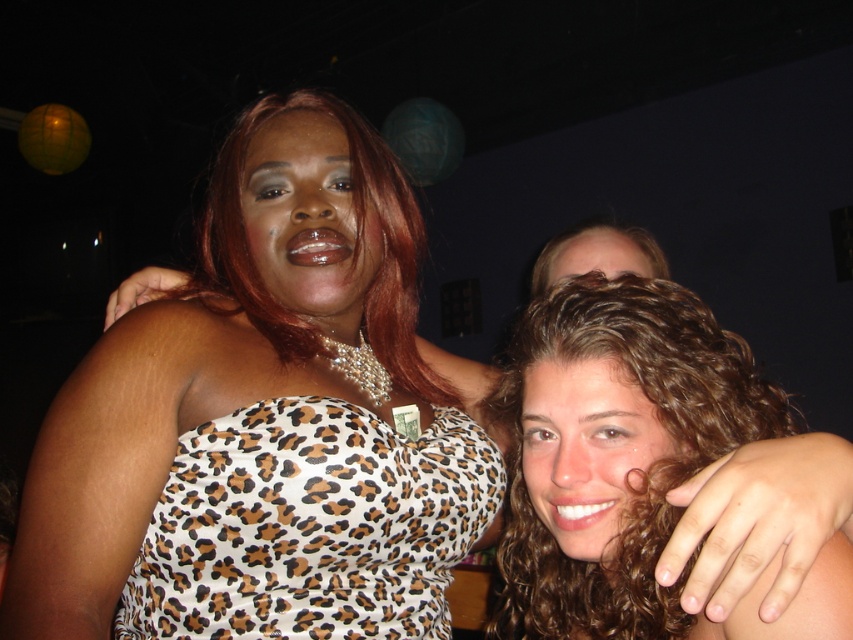
You are a photographer adjusting your camera settings in a dimly lit room. You notice two features in the image, the leopard print fabric dress at center and the curly hair at center. Which of these two features is located to the left when viewed from the photographer perspective?

The leopard print fabric dress at center is positioned on the left side of curly hair at center, so it is located to the left when viewed from the photographer perspective.